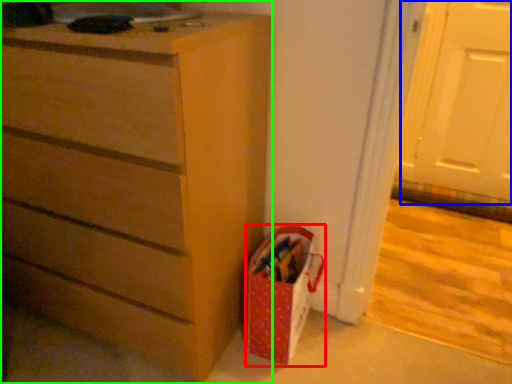
Question: Estimate the real-world distances between objects in this image. Which object is farther from gift bag (highlighted by a red box), screen door (highlighted by a blue box) or chest of drawers (highlighted by a green box)?

Choices:
 (A) screen door
 (B) chest of drawers

Answer: (A)